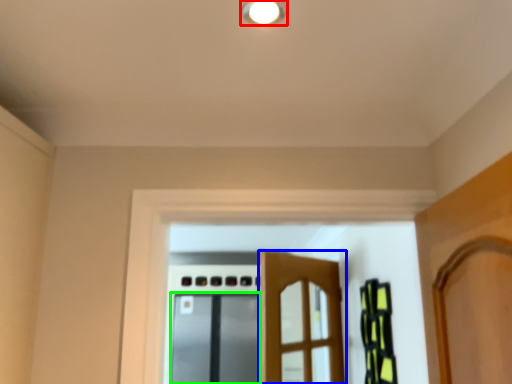
Question: Which is farther away from light fixture (highlighted by a red box)? door (highlighted by a blue box) or screen door (highlighted by a green box)?

Choices:
 (A) door
 (B) screen door

Answer: (B)